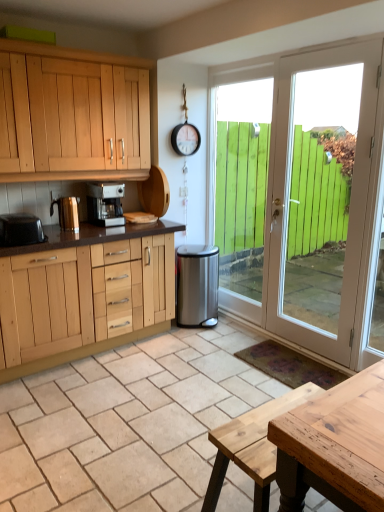
This screenshot has height=512, width=384. In order to click on stainless steel trash can at center, the 3th appliance viewed from the left in this screenshot , I will do `click(197, 285)`.

The height and width of the screenshot is (512, 384). Describe the element at coordinates (127, 423) in the screenshot. I see `natural stone tile at center` at that location.

At what (x,y) coordinates should I click in order to perform the action: click on natural stone tile at center. Please return your answer as a coordinate pair (x, y). The height and width of the screenshot is (512, 384). Looking at the image, I should click on (127, 423).

Image resolution: width=384 pixels, height=512 pixels. Identify the location of polished gold kettle at left, the 2th appliance positioned from the right. (67, 213).

Image resolution: width=384 pixels, height=512 pixels. Find the location of `satin silver coffee machine at upper center`. satin silver coffee machine at upper center is located at coordinates (105, 204).

What do you see at coordinates (240, 181) in the screenshot? I see `green wooden door at right` at bounding box center [240, 181].

Identify the location of white wood door at right. (306, 200).

I want to click on stainless steel trash can at center, which ranks as the 1th appliance in back-to-front order, so click(x=197, y=285).

From a real-world perspective, which object rests below the other?

white wood door at right, from a real-world perspective.

Between point (103, 204) and point (301, 330), which one is positioned behind?

The point (103, 204) is more distant.

Considering the positions of objects satin silver coffee machine at upper center and white wood door at right in the image provided, who is more to the right, satin silver coffee machine at upper center or white wood door at right?

Positioned to the right is white wood door at right.

Looking at this image, between satin silver coffee machine at upper center and white wood door at right, which one is positioned behind?

satin silver coffee machine at upper center is further away from the camera.

Can natural wood picnic table at center be found inside natural stone tile at center?

No.

Is natural stone tile at center closer to the viewer compared to natural wood picnic table at center?

Yes, it is in front of natural wood picnic table at center.

Considering the sizes of natural stone tile at center and natural wood picnic table at center in the image, is natural stone tile at center wider or thinner than natural wood picnic table at center?

Considering their sizes, natural stone tile at center looks broader than natural wood picnic table at center.

From the picture: Is natural stone tile at center shorter than natural wood picnic table at center?

Yes.

Considering the sizes of objects natural wood picnic table at center and white wood door at right in the image provided, who is wider, natural wood picnic table at center or white wood door at right?

natural wood picnic table at center is wider.

Is point (252, 444) closer to camera compared to point (263, 180)?

Yes.

Who is more distant, natural wood picnic table at center or white wood door at right?

white wood door at right is behind.

From the image's perspective, between natural wood picnic table at center and black plastic toaster at left, which is the first appliance from left to right, who is located below?

natural wood picnic table at center, from the image's perspective.

Are natural wood picnic table at center and black plastic toaster at left, which appears as the 3th appliance when viewed from the back, beside each other?

No.

Is natural wood picnic table at center taller or shorter than black plastic toaster at left, which is the first appliance from left to right?

Considering their sizes, natural wood picnic table at center has more height than black plastic toaster at left, which is the first appliance from left to right.

From a real-world perspective, is natural wood picnic table at center above or below black plastic toaster at left, which is counted as the 1th appliance, starting from the front?

From a real-world perspective, natural wood picnic table at center is physically below black plastic toaster at left, which is counted as the 1th appliance, starting from the front.

Based on the photo, which is more to the right, satin silver coffee machine at upper center or black plastic toaster at left, which is counted as the 3th appliance, starting from the right?

Positioned to the right is satin silver coffee machine at upper center.

From a real-world perspective, is satin silver coffee machine at upper center on top of black plastic toaster at left, which is the first appliance from left to right?

Yes.

Considering the sizes of objects satin silver coffee machine at upper center and black plastic toaster at left, which appears as the 3th appliance when viewed from the back, in the image provided, who is smaller, satin silver coffee machine at upper center or black plastic toaster at left, which appears as the 3th appliance when viewed from the back,?

Smaller between the two is black plastic toaster at left, which appears as the 3th appliance when viewed from the back.

Find the location of a particular element. This screenshot has height=512, width=384. kitchen appliance above the black plastic toaster at left, which is counted as the 1th appliance, starting from the front (from a real-world perspective) is located at coordinates (105, 204).

Which of these two, natural stone tile at center or stainless steel trash can at center, the 1th appliance from the right, stands shorter?

natural stone tile at center is shorter.

Is natural stone tile at center facing towards stainless steel trash can at center, acting as the 3th appliance starting from the front?

No, natural stone tile at center is not facing towards stainless steel trash can at center, acting as the 3th appliance starting from the front.

Looking at this image, is natural stone tile at center next to stainless steel trash can at center, acting as the 3th appliance starting from the front, and touching it?

No, natural stone tile at center is not touching stainless steel trash can at center, acting as the 3th appliance starting from the front.

Is polished gold kettle at left, the 2th appliance viewed from the left, positioned with its back to black plastic toaster at left, which is counted as the 3th appliance, starting from the right?

That's not correct — polished gold kettle at left, the 2th appliance viewed from the left, is not looking away from black plastic toaster at left, which is counted as the 3th appliance, starting from the right.

From a real-world perspective, is polished gold kettle at left, the 2th appliance viewed from the left, beneath black plastic toaster at left, which appears as the 3th appliance when viewed from the back?

Incorrect, from a real-world perspective, polished gold kettle at left, the 2th appliance viewed from the left, is higher than black plastic toaster at left, which appears as the 3th appliance when viewed from the back.

Based on the photo, is polished gold kettle at left, positioned as the 2th appliance in back-to-front order, touching black plastic toaster at left, which is counted as the 3th appliance, starting from the right?

No.

Who is taller, polished gold kettle at left, positioned as the 2th appliance in back-to-front order, or black plastic toaster at left, which is counted as the 3th appliance, starting from the right?

polished gold kettle at left, positioned as the 2th appliance in back-to-front order, is taller.

Where is `door in front of the satin silver coffee machine at upper center`? door in front of the satin silver coffee machine at upper center is located at coordinates (306, 200).

The height and width of the screenshot is (512, 384). I want to click on picnic table located above the natural stone tile at center (from the image's perspective), so click(x=251, y=447).

Estimate the real-world distances between objects in this image. Which object is further from polished gold kettle at left, positioned as the 2th appliance in back-to-front order, natural stone tile at center or natural wood picnic table at center?

Based on the image, natural wood picnic table at center appears to be further to polished gold kettle at left, positioned as the 2th appliance in back-to-front order.

From the picture: Looking at the image, which one is located further to polished gold kettle at left, placed as the 2th appliance when sorted from front to back, stainless steel trash can at center, acting as the 3th appliance starting from the front, or natural stone tile at center?

natural stone tile at center is further to polished gold kettle at left, placed as the 2th appliance when sorted from front to back.

From the image, which object appears to be farther from green wooden door at right, natural stone tile at center or polished gold kettle at left, positioned as the 2th appliance in back-to-front order?

The object further to green wooden door at right is polished gold kettle at left, positioned as the 2th appliance in back-to-front order.

Looking at the image, which one is located further to natural stone tile at center, satin silver coffee machine at upper center or polished gold kettle at left, the 2th appliance positioned from the right?

satin silver coffee machine at upper center lies further to natural stone tile at center than the other object.

From the image, which object appears to be nearer to black plastic toaster at left, which appears as the 3th appliance when viewed from the back, polished gold kettle at left, placed as the 2th appliance when sorted from front to back, or white wood door at right?

polished gold kettle at left, placed as the 2th appliance when sorted from front to back, lies closer to black plastic toaster at left, which appears as the 3th appliance when viewed from the back, than the other object.

Based on their spatial positions, is black plastic toaster at left, which is counted as the 1th appliance, starting from the front, or polished gold kettle at left, the 2th appliance viewed from the left, further from natural wood picnic table at center?

polished gold kettle at left, the 2th appliance viewed from the left.

Looking at the image, which one is located further to satin silver coffee machine at upper center, polished gold kettle at left, the 2th appliance positioned from the right, or white wood door at right?

white wood door at right lies further to satin silver coffee machine at upper center than the other object.

Based on their spatial positions, is natural wood picnic table at center or stainless steel trash can at center, the 1th appliance from the right, further from satin silver coffee machine at upper center?

natural wood picnic table at center.

The height and width of the screenshot is (512, 384). Find the location of `door between natural stone tile at center and polished gold kettle at left, positioned as the 2th appliance in back-to-front order, in the front-back direction`. door between natural stone tile at center and polished gold kettle at left, positioned as the 2th appliance in back-to-front order, in the front-back direction is located at coordinates (306, 200).

What are the coordinates of `picnic table positioned between natural stone tile at center and stainless steel trash can at center, which ranks as the 1th appliance in back-to-front order, from near to far` in the screenshot? It's located at (251, 447).

The image size is (384, 512). In order to click on window located between satin silver coffee machine at upper center and white wood door at right in the left-right direction in this screenshot , I will do `click(240, 181)`.

Where is `picnic table between black plastic toaster at left, which is counted as the 1th appliance, starting from the front, and white wood door at right from left to right`? This screenshot has height=512, width=384. picnic table between black plastic toaster at left, which is counted as the 1th appliance, starting from the front, and white wood door at right from left to right is located at coordinates (251, 447).